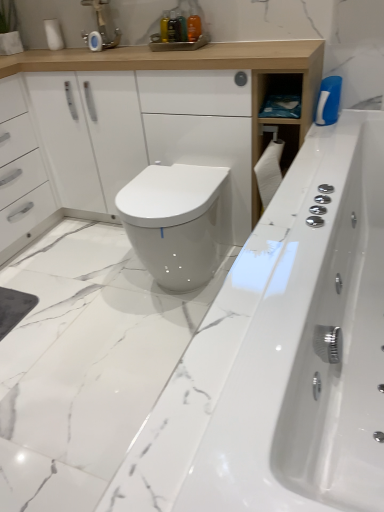
Where is `free point above white glossy bidet at center (from a real-world perspective)`? Image resolution: width=384 pixels, height=512 pixels. free point above white glossy bidet at center (from a real-world perspective) is located at coordinates click(177, 184).